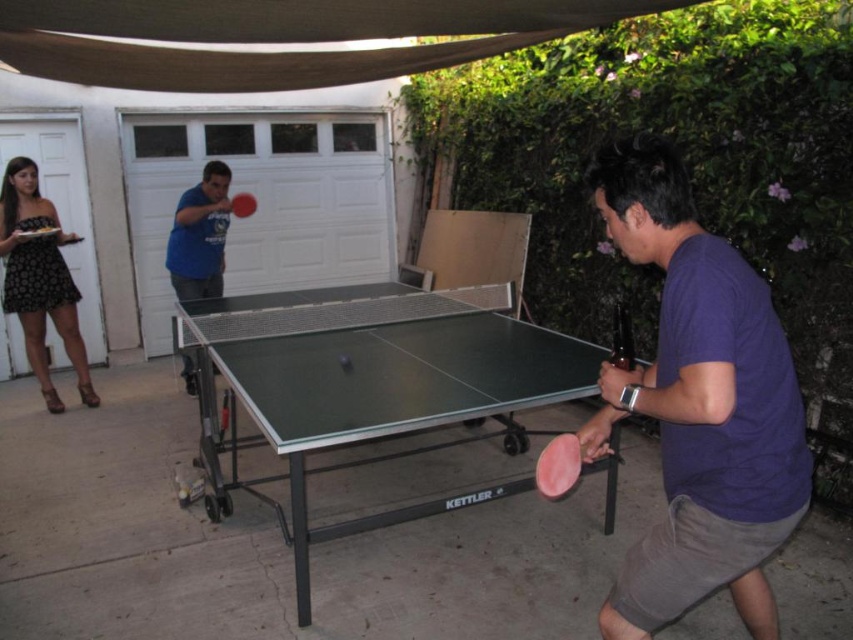
You are a photographer trying to capture a candid shot of the ping pong game. You want to ensure both the black lace dress at left and the pink rubber paddle at center are visible in the frame. Based on their positions, which object should you focus on first to include both in the shot?

The black lace dress at left is to the left of the pink rubber paddle at center. To include both in the frame, focus on the black lace dress at left first as it is positioned further left, ensuring the pink rubber paddle at center remains within the shot to the right.

You are a photographer setting up for a table tennis match. You need to position a camera on a tripod so that it captures both the black lace dress at left and the pink rubber paddle at center without any obstructions. Based on their positions, where should you place the tripod?

The black lace dress at left is located below the pink rubber paddle at center, so placing the tripod centrally between them would ensure both are in frame without obstruction.